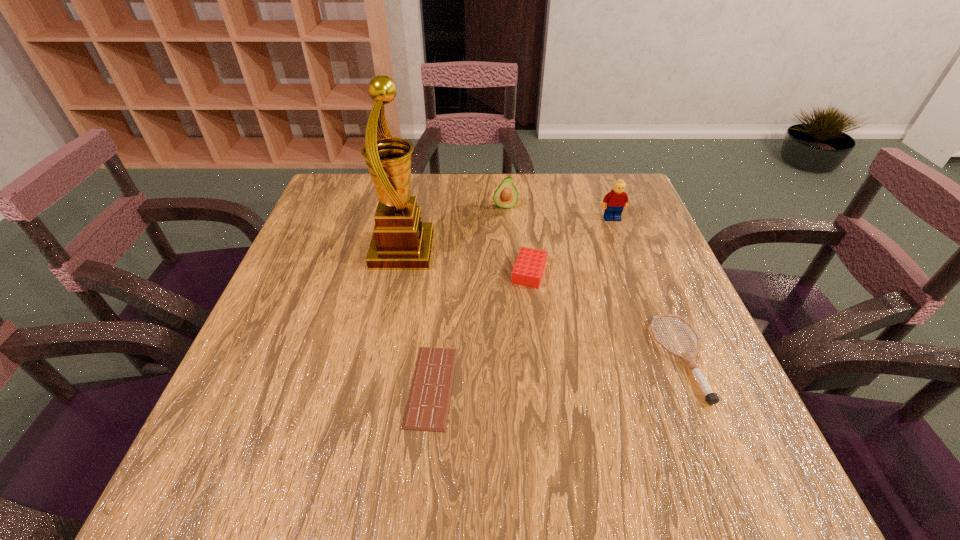
I want to click on blank space at the far edge, so click(x=378, y=201).

Locate an element on the screen. free spot at the left edge of the desktop is located at coordinates pos(299,366).

In the image, there is a desktop. Identify the location of vacant space at the right edge. The height and width of the screenshot is (540, 960). (702, 391).

The image size is (960, 540). Find the location of `free region at the far left corner of the desktop`. free region at the far left corner of the desktop is located at coordinates (338, 188).

Locate an element on the screen. vacant space at the far right corner is located at coordinates (644, 205).

You are a GUI agent. You are given a task and a screenshot of the screen. Output one action in this format:
    pyautogui.click(x=<x>, y=<y>)
    Task: Click on the free region at the near right corner of the desktop
    
    Given the screenshot: What is the action you would take?
    pyautogui.click(x=694, y=498)

The width and height of the screenshot is (960, 540). In order to click on free spot between the shortest object and the tennis racket in this screenshot , I will do `click(557, 372)`.

Locate an element on the screen. Image resolution: width=960 pixels, height=540 pixels. blank region between the fifth tallest object and the third tallest object is located at coordinates (593, 282).

Find the location of a particular element. free space between the shortest object and the tennis racket is located at coordinates (557, 372).

Identify the location of vacant space that is in between the farther Lego and the award. The image size is (960, 540). (507, 234).